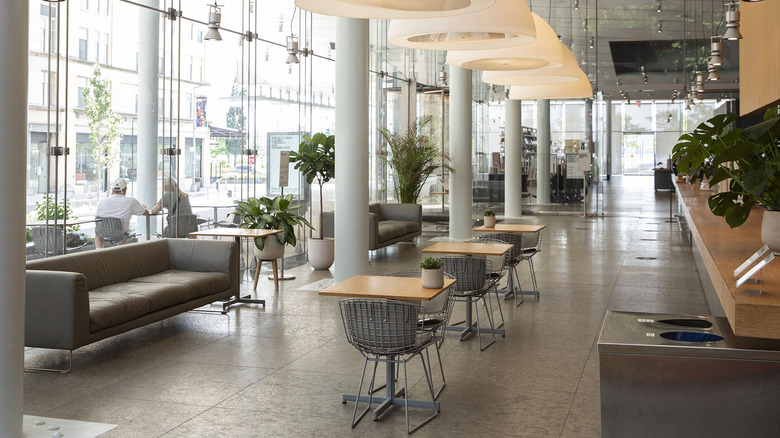
Where is `large pendant light`? The width and height of the screenshot is (780, 438). large pendant light is located at coordinates click(x=566, y=91), click(x=575, y=69), click(x=541, y=52), click(x=519, y=29), click(x=371, y=12).